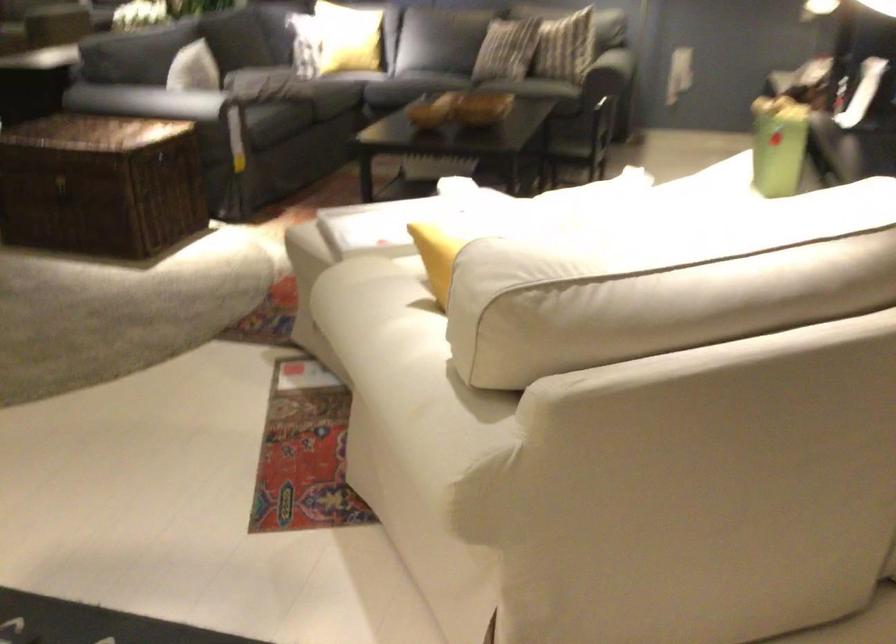
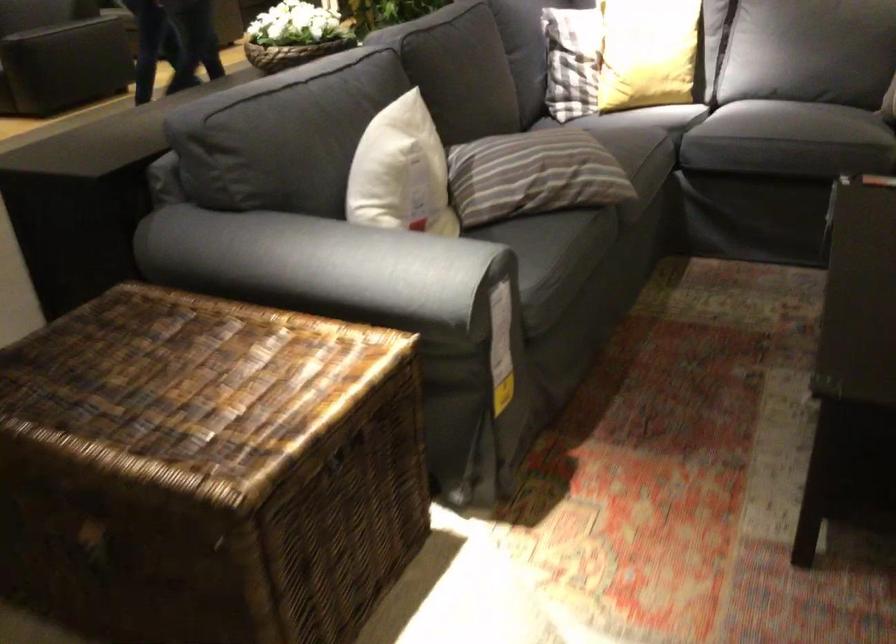
Question: Which direction would the cameraman need to move to produce the second image? Reply with the corresponding letter.

Choices:
 (A) Left
 (B) Right
 (C) Forward
 (D) Backward

Answer: (C)